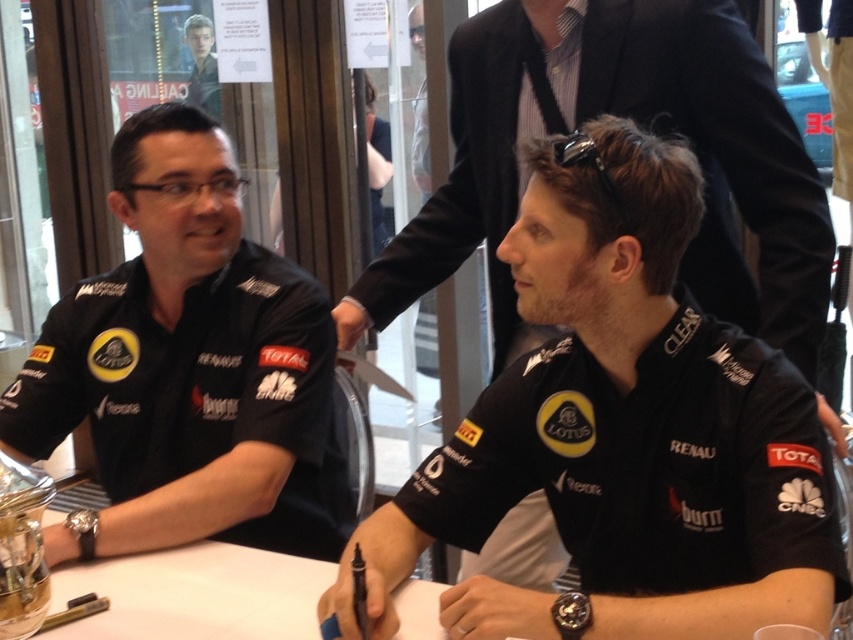
Does black matte shirt at left appear under white glossy table at center?

No.

How far apart are black matte shirt at left and white glossy table at center?

They are 11.08 inches apart.

Which is behind, point (230, 449) or point (70, 628)?

Point (230, 449)

The height and width of the screenshot is (640, 853). I want to click on black matte shirt at left, so click(189, 369).

Can you confirm if black matte shirt at center is taller than black matte shirt at left?

No.

Find the location of `black matte shirt at center`. black matte shirt at center is located at coordinates (621, 433).

Which is in front, point (474, 618) or point (86, 582)?

Point (474, 618)

Does black matte shirt at center have a smaller size compared to white glossy table at center?

No.

Where is `black matte shirt at center`? black matte shirt at center is located at coordinates (621, 433).